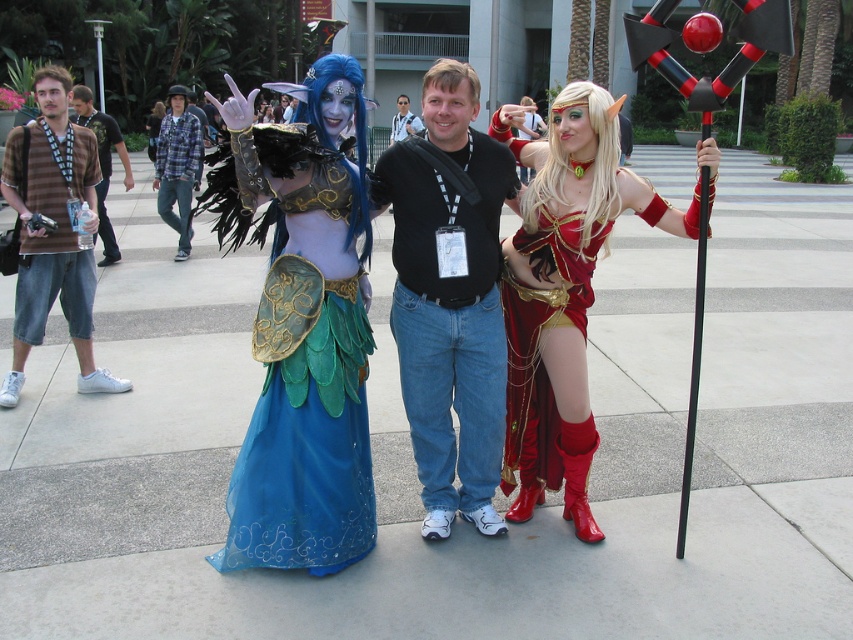
You are a photographer at the event and need to position the shiny red fabric dress at right and the plaid flannel shirt at left in a group photo. If you want to avoid the head of one blocking the other, which one should be placed in the back?

The shiny red fabric dress at right is not as tall as plaid flannel shirt at left, so the plaid flannel shirt at left should be placed in the back to avoid blocking the shorter one.

You are a photographer at the event and need to position yourself to capture a photo of the brown striped shirt at left without any obstructions. Based on the coordinates provided, where should you stand relative to the shirt?

Since the brown striped shirt at left is located at point (102, 163), you should position yourself in a location that is not directly behind or in front of these coordinates to avoid obstructions. Ensure there are no objects or people blocking the line of sight at those coordinates for a clear shot.